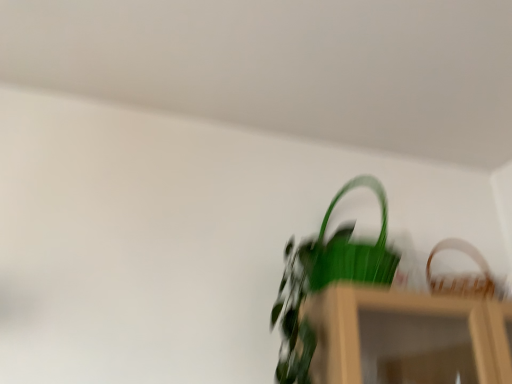
This screenshot has width=512, height=384. What do you see at coordinates (326, 279) in the screenshot?
I see `green matte plant at center` at bounding box center [326, 279].

I want to click on green matte plant at center, so click(x=326, y=279).

This screenshot has height=384, width=512. What do you see at coordinates (461, 274) in the screenshot? I see `wooden woven basket at upper right` at bounding box center [461, 274].

This screenshot has height=384, width=512. I want to click on wooden woven basket at upper right, so click(461, 274).

This screenshot has width=512, height=384. What are the coordinates of `green matte plant at center` in the screenshot? It's located at (326, 279).

Is green matte plant at center to the right of wooden woven basket at upper right from the viewer's perspective?

In fact, green matte plant at center is to the left of wooden woven basket at upper right.

Does green matte plant at center come behind wooden woven basket at upper right?

No.

Is point (320, 254) behind point (471, 248)?

No, (320, 254) is in front of (471, 248).

From the image's perspective, between green matte plant at center and wooden woven basket at upper right, which one is located above?

green matte plant at center is shown above in the image.

From a real-world perspective, who is located higher, green matte plant at center or wooden woven basket at upper right?

wooden woven basket at upper right is physically above.

Considering the relative sizes of green matte plant at center and wooden woven basket at upper right in the image provided, is green matte plant at center wider than wooden woven basket at upper right?

Yes.

From the picture: From their relative heights in the image, would you say green matte plant at center is taller or shorter than wooden woven basket at upper right?

In the image, green matte plant at center appears to be taller than wooden woven basket at upper right.

Which of these two, green matte plant at center or wooden woven basket at upper right, is smaller?

Smaller between the two is wooden woven basket at upper right.

Could wooden woven basket at upper right be considered to be inside green matte plant at center?

Actually, wooden woven basket at upper right is outside green matte plant at center.

Would you consider green matte plant at center to be distant from wooden woven basket at upper right?

green matte plant at center is actually quite close to wooden woven basket at upper right.

Is green matte plant at center positioned with its back to wooden woven basket at upper right?

green matte plant at center does not have its back to wooden woven basket at upper right.

How much distance is there between green matte plant at center and wooden woven basket at upper right?

green matte plant at center and wooden woven basket at upper right are 14.24 inches apart.

Identify the location of houseplant located in front of the wooden woven basket at upper right. (326, 279).

Which is more to the left, wooden woven basket at upper right or green matte plant at center?

Positioned to the left is green matte plant at center.

Relative to green matte plant at center, is wooden woven basket at upper right in front or behind?

Clearly, wooden woven basket at upper right is behind green matte plant at center.

Between point (429, 270) and point (326, 212), which one is positioned in front?

The point (326, 212) is in front.

From the image's perspective, is wooden woven basket at upper right under green matte plant at center?

Indeed, from the image's perspective, wooden woven basket at upper right is shown beneath green matte plant at center.

From a real-world perspective, is wooden woven basket at upper right under green matte plant at center?

No, from a real-world perspective, wooden woven basket at upper right is not beneath green matte plant at center.

Which of these two, wooden woven basket at upper right or green matte plant at center, is thinner?

wooden woven basket at upper right is thinner.

Between wooden woven basket at upper right and green matte plant at center, which one has less height?

With less height is wooden woven basket at upper right.

Between wooden woven basket at upper right and green matte plant at center, which one has larger size?

With larger size is green matte plant at center.

Is green matte plant at center located within wooden woven basket at upper right?

No, green matte plant at center is located outside of wooden woven basket at upper right.

Is the surface of wooden woven basket at upper right in direct contact with green matte plant at center?

No, wooden woven basket at upper right is not in contact with green matte plant at center.

Is wooden woven basket at upper right positioned with its back to green matte plant at center?

No.

Can you tell me how much wooden woven basket at upper right and green matte plant at center differ in facing direction?

4.77 degrees.

Where is `basket that is above the green matte plant at center (from a real-world perspective)`? basket that is above the green matte plant at center (from a real-world perspective) is located at coordinates (461, 274).

At what (x,y) coordinates should I click in order to perform the action: click on basket on the right of the green matte plant at center. Please return your answer as a coordinate pair (x, y). Looking at the image, I should click on (461, 274).

Locate an element on the screen. The image size is (512, 384). basket that is behind the green matte plant at center is located at coordinates (461, 274).